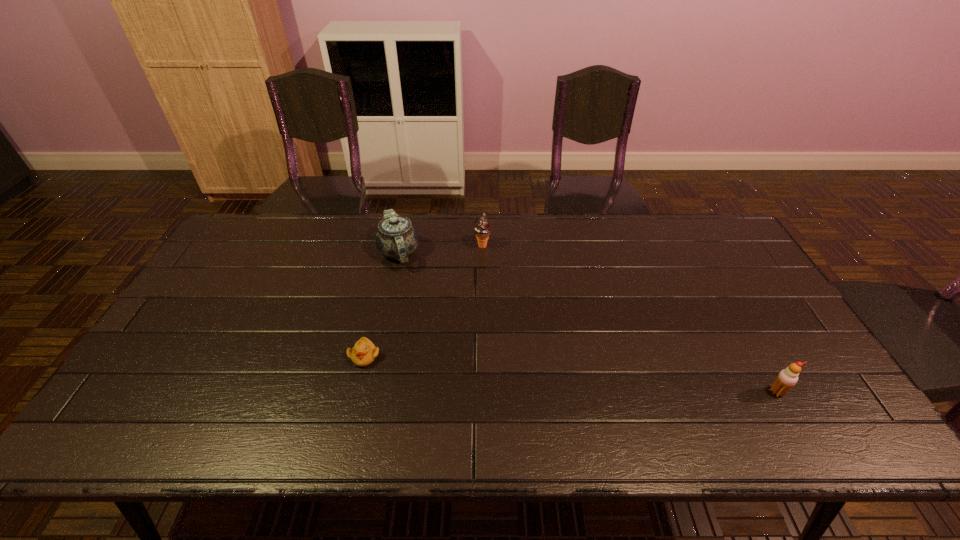
Find the location of a particular element. chinaware is located at coordinates (396, 238).

Image resolution: width=960 pixels, height=540 pixels. What are the coordinates of `the farther icecream` in the screenshot? It's located at tap(482, 229).

Where is `the left icecream`? the left icecream is located at coordinates pyautogui.click(x=482, y=229).

At what (x,y) coordinates should I click in order to perform the action: click on the rightmost object. Please return your answer as a coordinate pair (x, y). The height and width of the screenshot is (540, 960). Looking at the image, I should click on (787, 378).

Find the location of a particular element. the nearest object is located at coordinates click(787, 378).

Locate an element on the screen. This screenshot has width=960, height=540. the third farthest object is located at coordinates (364, 352).

Identify the location of the shortest object. The width and height of the screenshot is (960, 540). (364, 352).

Find the location of a particular element. This screenshot has height=540, width=960. vacant area situated from the spout of the chinaware is located at coordinates (386, 312).

Where is `free space located 0.160m on the front of the second object from right to left`? This screenshot has width=960, height=540. free space located 0.160m on the front of the second object from right to left is located at coordinates (483, 285).

Find the location of a particular element. This screenshot has height=540, width=960. free space located 0.060m at the front with a straw on the right icecream is located at coordinates (794, 422).